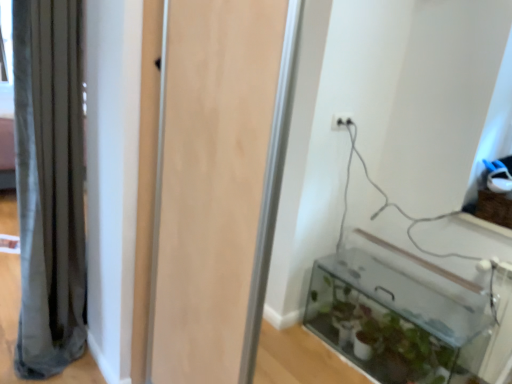
The height and width of the screenshot is (384, 512). What do you see at coordinates (49, 184) in the screenshot?
I see `velvet gray curtain at left` at bounding box center [49, 184].

Measure the distance between velvet gray curtain at left and camera.

4.93 feet.

Identify the location of velvet gray curtain at left. The image size is (512, 384). [x=49, y=184].

Locate an element on the screen. The height and width of the screenshot is (384, 512). velvet gray curtain at left is located at coordinates (49, 184).